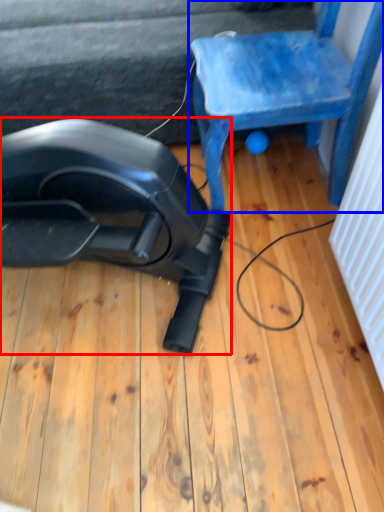
Question: Which object appears closest to the camera in this image, equipment (highlighted by a red box) or chair (highlighted by a blue box)?

Choices:
 (A) equipment
 (B) chair

Answer: (A)